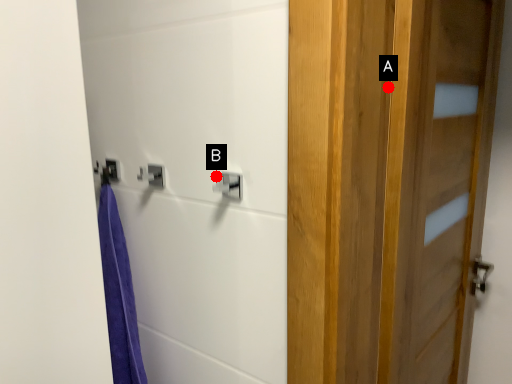
Question: Two points are circled on the image, labeled by A and B beside each circle. Which of the following is the farthest from the observer?

Choices:
 (A) A is further
 (B) B is further

Answer: (B)